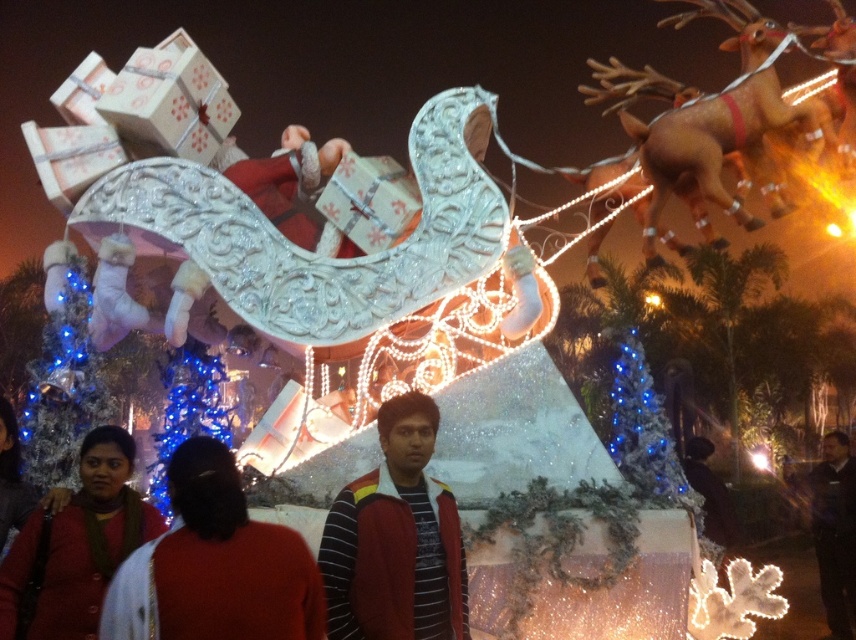
You are a photographer trying to capture the perfect shot of the festive scene. You want to ensure the red woolen sweater at lower left is centered in your photo. Given its current position at coordinates, what adjustment should you make to the camera frame to center it?

The red woolen sweater at lower left is located at point 0.842 on the x and 0.107 on the y axis. To center it, adjust the camera frame so the sweater moves to the center coordinates, which would require shifting the frame slightly to the right and upwards since its current position is lower left.

You are standing in front of the festive float and want to take a photo. There are two points marked on the float at coordinates point (105, 545) and point (611, 403). Which point is closer to your camera lens?

Point (105, 545) is closer to the camera than point (611, 403), so it will appear larger in your photo.

You are standing in the festive scene and notice the black leather jacket at lower right. Where exactly is it positioned in relation to the Santa Claus float?

The black leather jacket at lower right is located at point coordinates approximately 0.833 on the x axis and 0.977 on the y axis, which places it near the lower right corner of the scene relative to Santa Claus float.